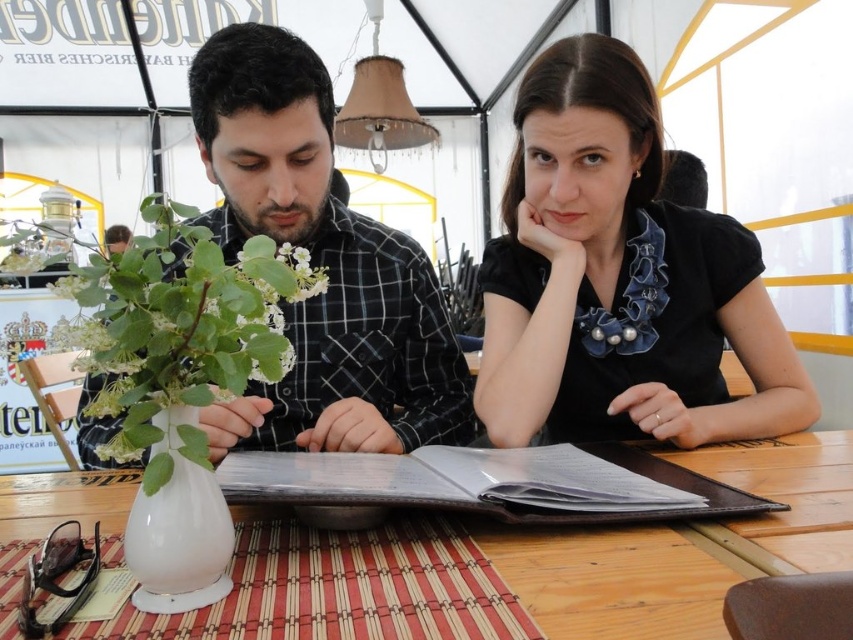
You are a server at the restaurant and need to place a small dish between the black satin blouse at center and the white matte flower at center. Based on their positions, where should you place the dish?

The black satin blouse at center is positioned over the white matte flower at center, so the dish should be placed between them on the table surface below the blouse.

You are a photographer taking a picture of the scene. You want to focus on the point that is closer to the camera. Which point should you choose between point (538, 403) and point (206, 474)?

Point (206, 474) is closer to the camera than point (538, 403), so you should choose point (206, 474) to focus on.